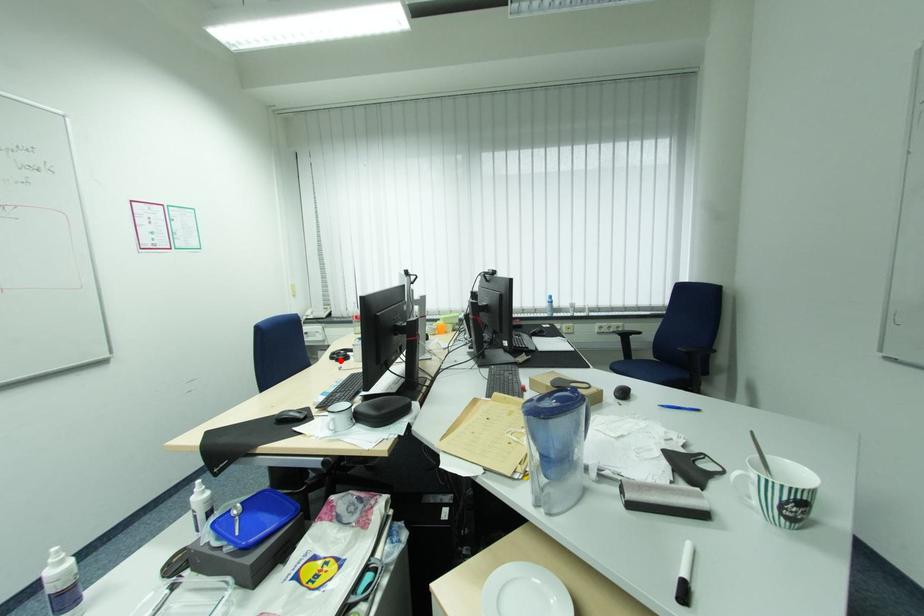
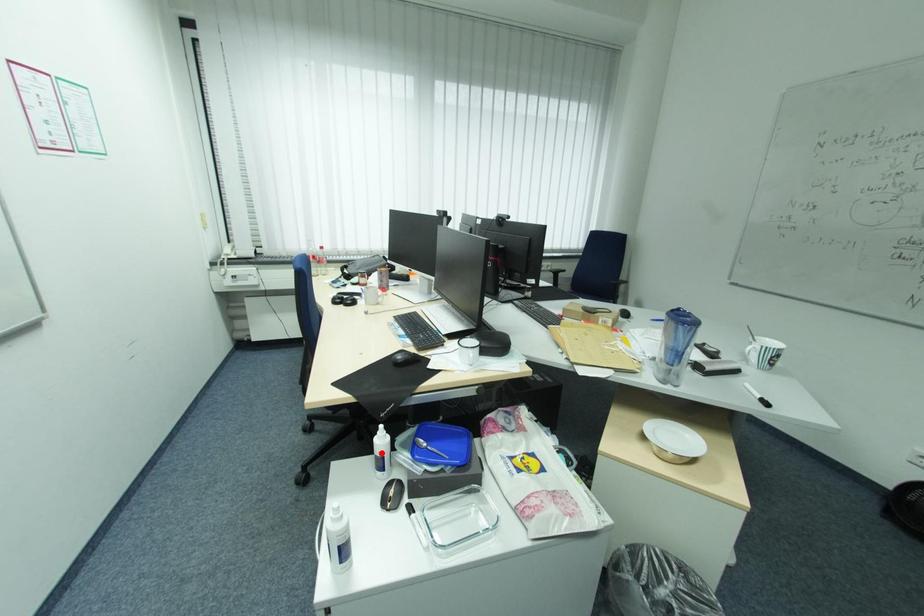
I am providing you with two images of the same scene from different viewpoints. A red point is marked on the first image and another point is marked on the second image. Is the marked point in image1 the same physical position as the marked point in image2?

No